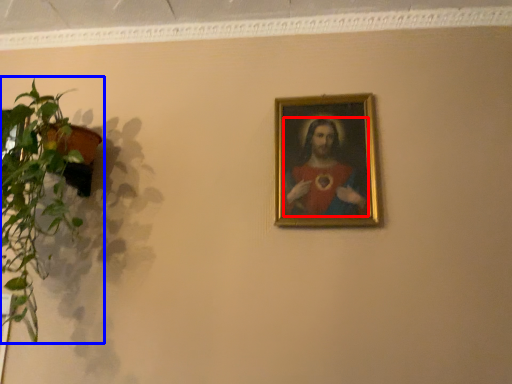
Question: Among these objects, which one is nearest to the camera, person (highlighted by a red box) or houseplant (highlighted by a blue box)?

Choices:
 (A) person
 (B) houseplant

Answer: (B)